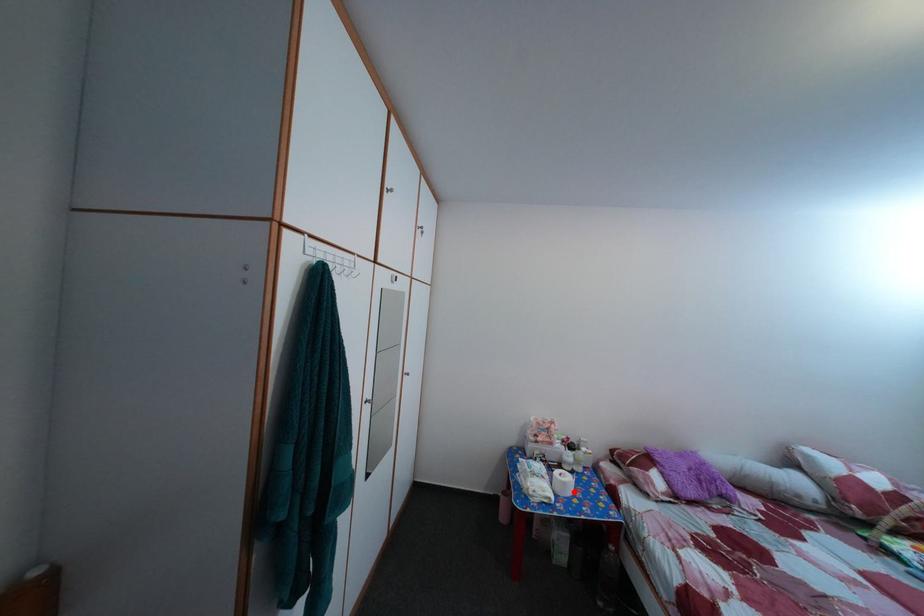
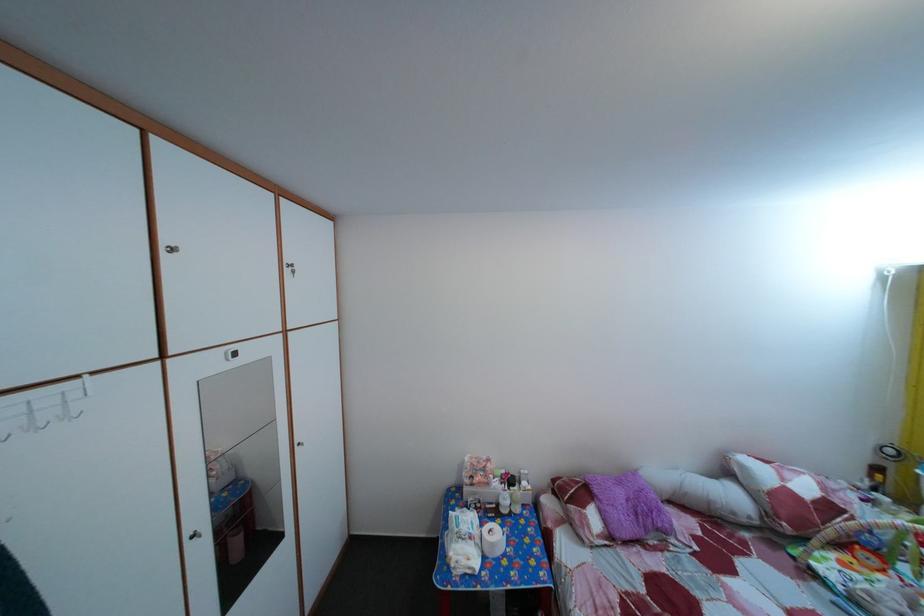
Find the pixel in the second image that matches the highlighted location in the first image.

(502, 553)